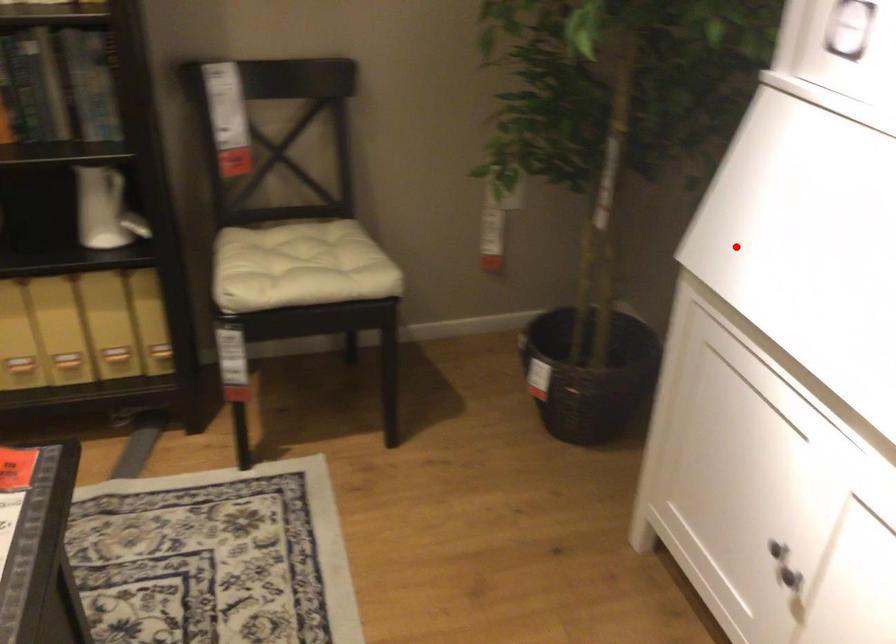
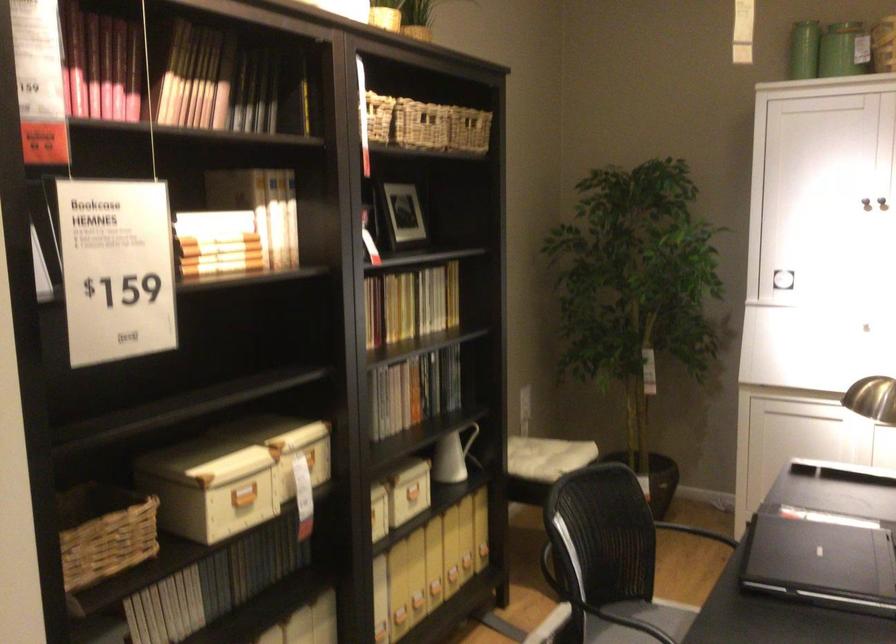
In the second image, find the point that corresponds to the highlighted location in the first image.

(791, 351)